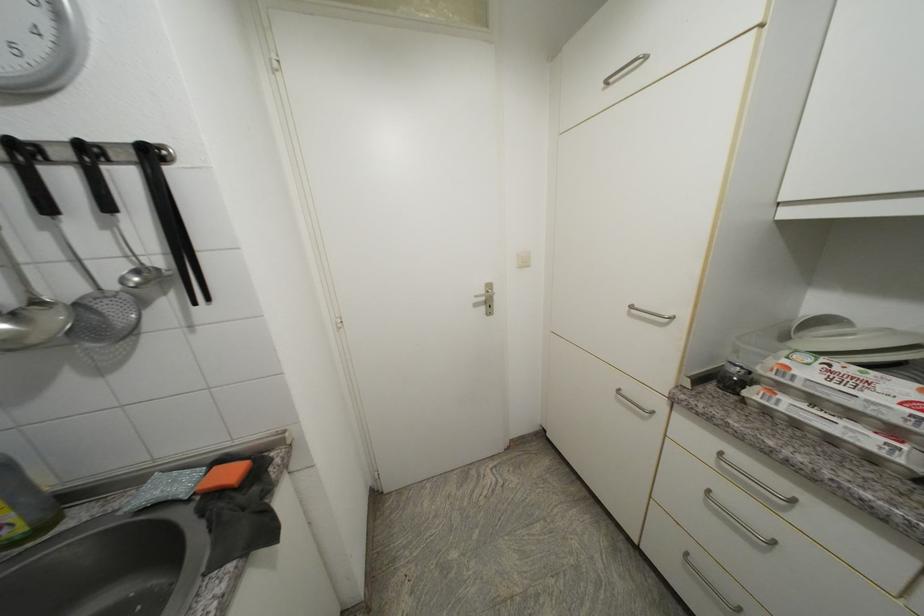
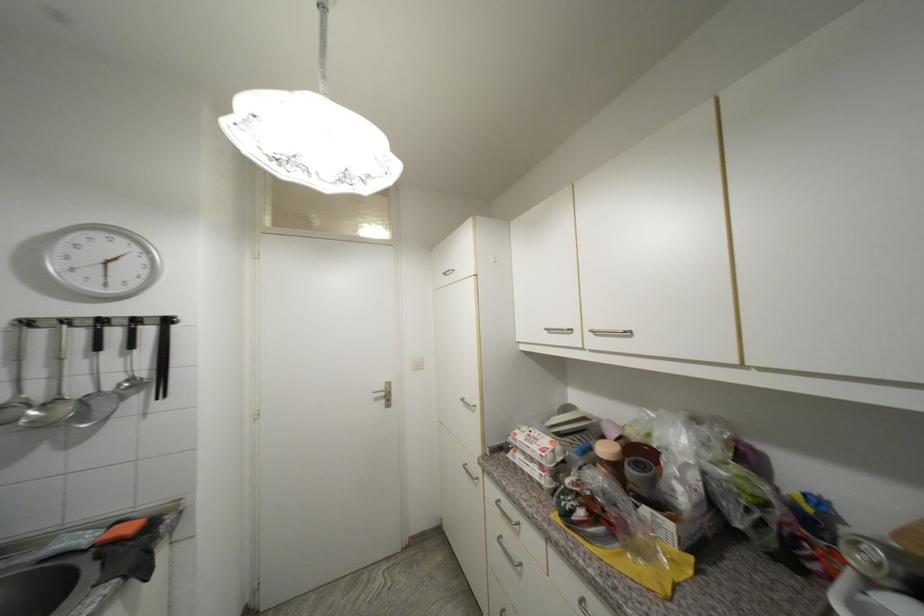
Where in the second image is the point corresponding to [638,309] from the first image?

(468, 400)